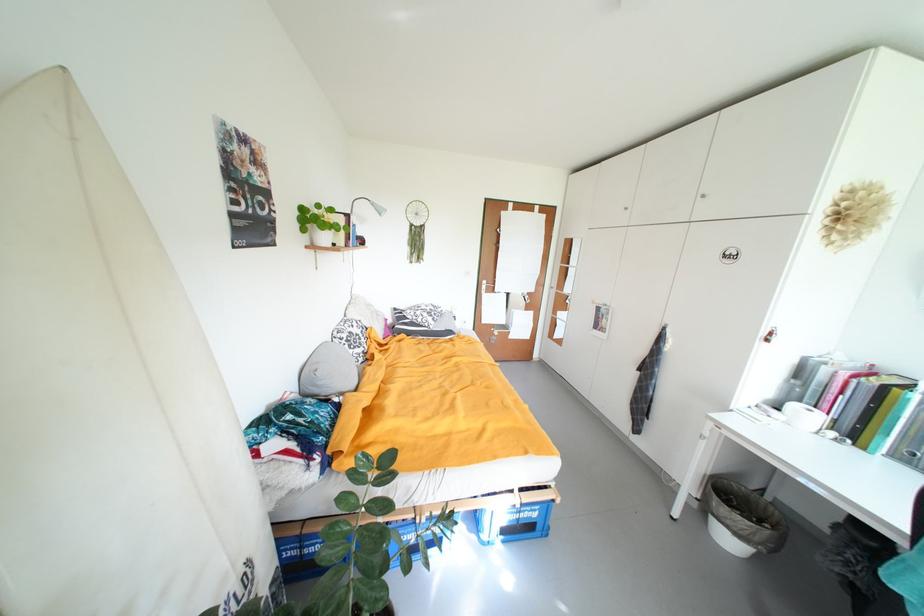
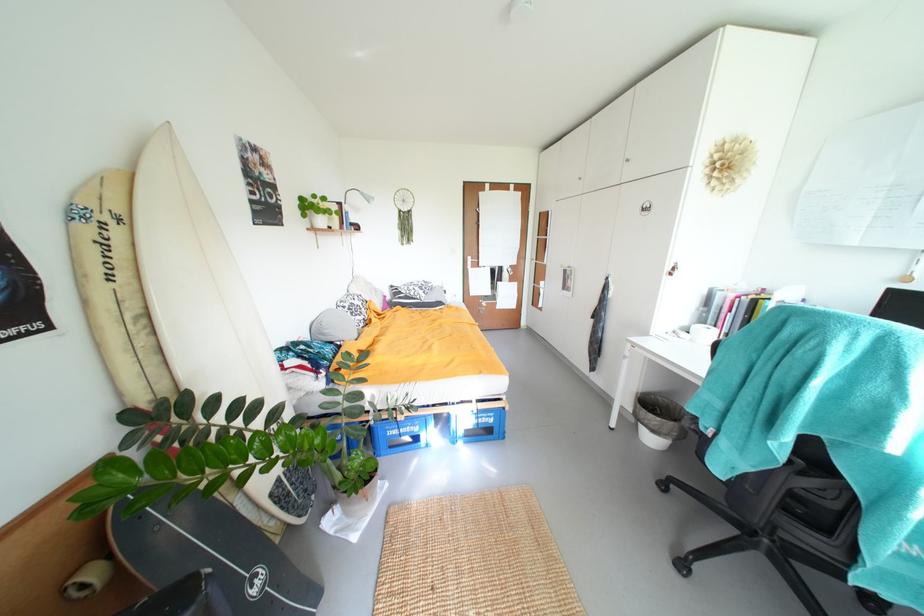
In the second image, find the point that corresponds to the point at 494,294 in the first image.

(480, 268)